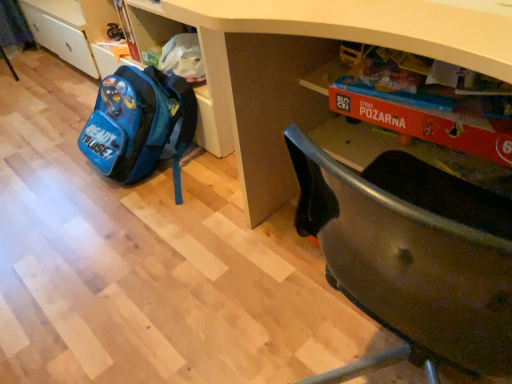
Locate an element on the screen. Image resolution: width=512 pixels, height=384 pixels. free space to the left of blue fabric backpack at lower left is located at coordinates (51, 182).